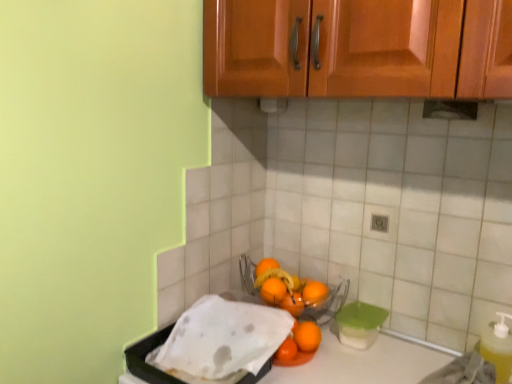
Question: From a real-world perspective, is white paper towel at lower left, which is counted as the second wash, starting from the right, positioned above or below orange matte at center, marked as the 4th orange in a top-to-bottom arrangement?

Choices:
 (A) below
 (B) above

Answer: (A)

Question: Considering the relative positions of white paper towel at lower left, the first wash viewed from the left, and orange matte at center, the 2th orange positioned from the bottom, in the image provided, is white paper towel at lower left, the first wash viewed from the left, to the left or to the right of orange matte at center, the 2th orange positioned from the bottom,?

Choices:
 (A) left
 (B) right

Answer: (A)

Question: Based on their relative distances, which object is farther from the orange matte at lower center, the 1th orange in the top-to-bottom sequence?

Choices:
 (A) orange matte bowl at center, which is counted as the second wash, starting from the left
 (B) orange matte at center, marked as the 4th orange in a top-to-bottom arrangement
 (C) orange matte at lower right, which is the 5th orange in top-to-bottom order
 (D) orange matte at center, the 4th orange when ordered from bottom to top
 (E) orange matte at center, the third orange when ordered from top to bottom

Answer: (C)

Question: Estimate the real-world distances between objects in this image. Which object is closer to the white paper towel at lower left, which is counted as the second wash, starting from the right?

Choices:
 (A) orange matte at center, the third orange when ordered from bottom to top
 (B) orange matte at center, placed as the second orange when sorted from top to bottom
 (C) yellow translucent bottle at lower right
 (D) orange matte bowl at center, which is counted as the second wash, starting from the left
 (E) orange matte at lower center, the 1th orange in the top-to-bottom sequence

Answer: (D)